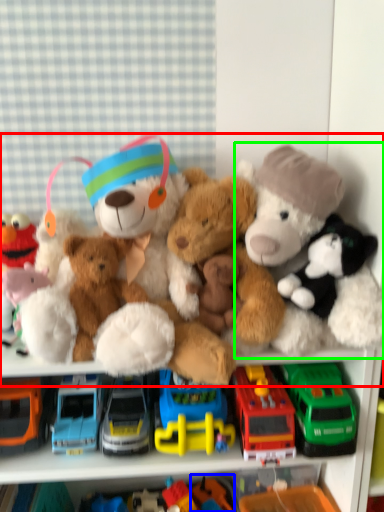
Question: Which object is positioned farthest from teddy bear (highlighted by a red box)? Select from toy (highlighted by a blue box) and toy (highlighted by a green box).

Choices:
 (A) toy
 (B) toy

Answer: (A)